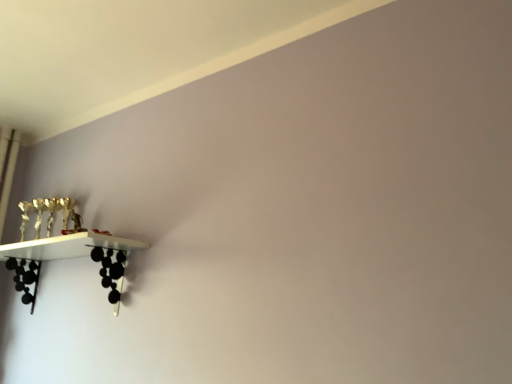
In order to face white matte shelf at lower left, should I rotate leftwards or rightwards?

Turn left by 26.247 degrees to look at white matte shelf at lower left.

Image resolution: width=512 pixels, height=384 pixels. I want to click on white matte shelf at lower left, so click(70, 257).

What is the approximate width of white matte shelf at lower left?

It is 11.16 inches.

What do you see at coordinates (70, 257) in the screenshot? I see `white matte shelf at lower left` at bounding box center [70, 257].

Locate an element on the screen. This screenshot has height=384, width=512. white matte shelf at lower left is located at coordinates click(70, 257).